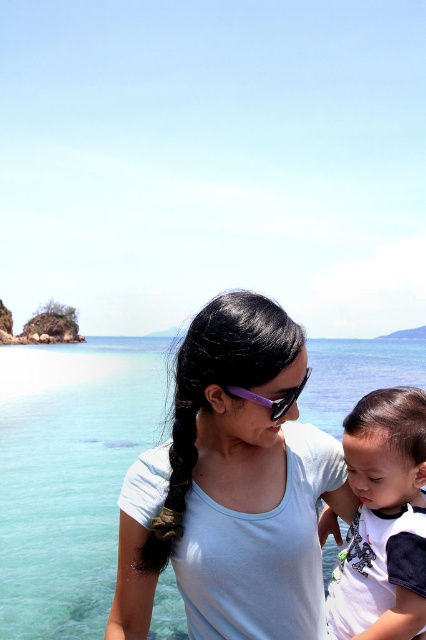
Question: Observing the image, what is the correct spatial positioning of clear blue water at center in reference to white cotton shirt at lower right?

Choices:
 (A) above
 (B) below

Answer: (B)

Question: Where is clear blue water at center located in relation to white cotton shirt at lower right in the image?

Choices:
 (A) above
 (B) below

Answer: (B)

Question: Which of the following is the closest to the observer?

Choices:
 (A) (118, 400)
 (B) (282, 403)

Answer: (B)

Question: Among these objects, which one is farthest from the camera?

Choices:
 (A) purple plastic goggles at center
 (B) clear blue water at center
 (C) white cotton shirt at lower right

Answer: (B)

Question: Among these objects, which one is farthest from the camera?

Choices:
 (A) clear blue water at center
 (B) white cotton shirt at lower right

Answer: (A)

Question: Does clear blue water at center appear on the left side of white cotton shirt at lower right?

Choices:
 (A) no
 (B) yes

Answer: (B)